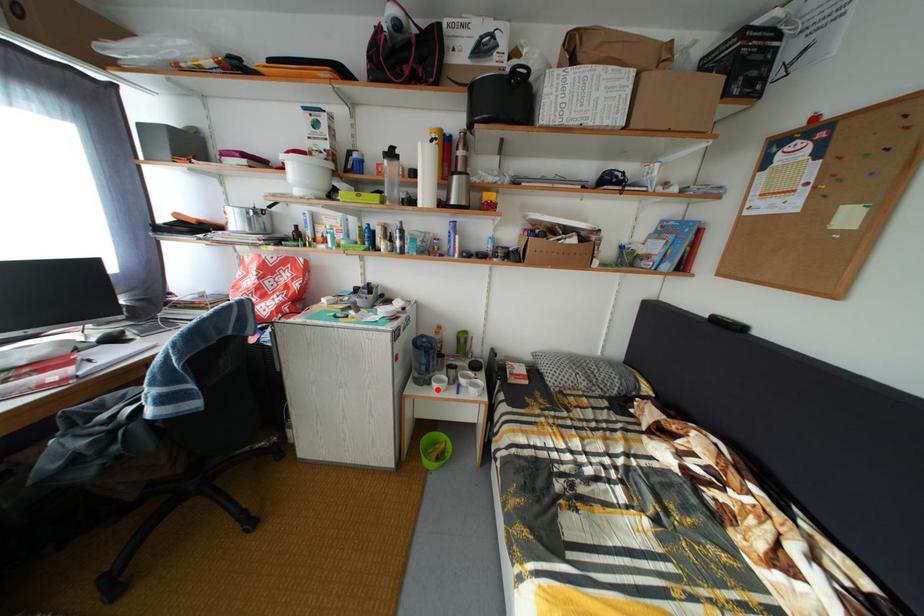
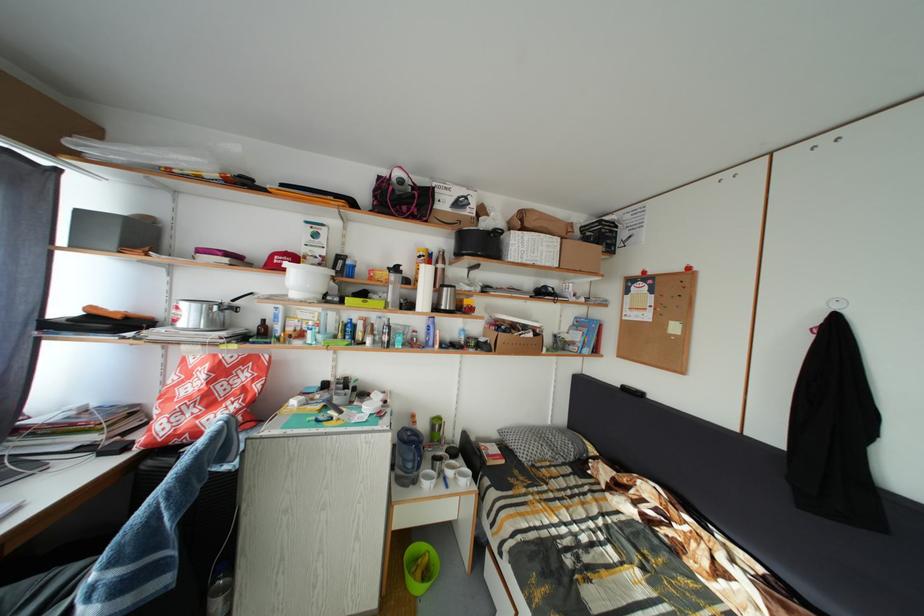
Question: I am providing you with two images of the same scene from different viewpoints. Image1 has a red point marked. In image2, the corresponding 3D location appears at what relative position? Reply with the corresponding letter.

Choices:
 (A) Closer
 (B) Farther

Answer: (B)